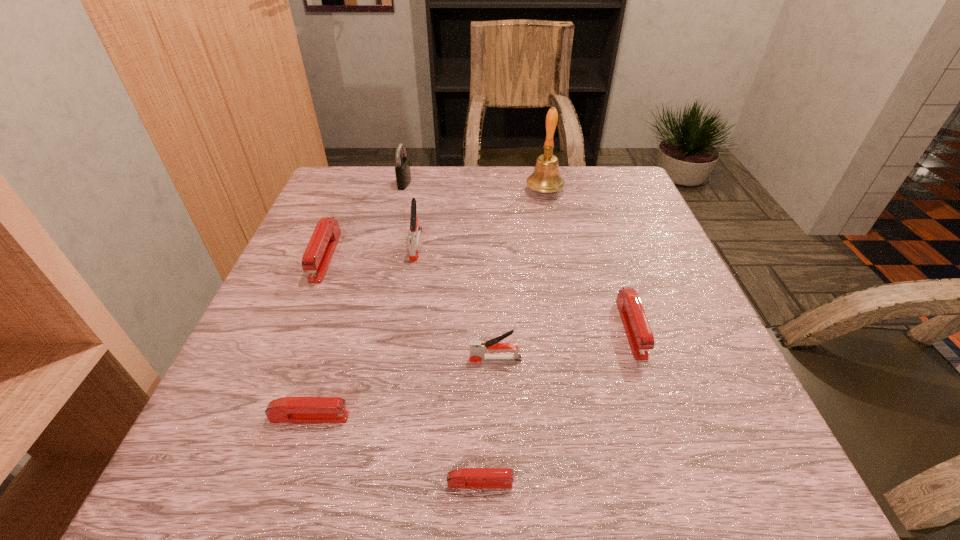
The width and height of the screenshot is (960, 540). In order to click on blank space located on the handle side of the right gray stapler in this screenshot , I will do `click(419, 359)`.

The width and height of the screenshot is (960, 540). I want to click on vacant space located on the front-facing side of the leftmost red stapler, so click(256, 426).

Find the location of `vacant area situated 0.120m on the front-facing side of the rightmost stapler`. vacant area situated 0.120m on the front-facing side of the rightmost stapler is located at coordinates (663, 424).

The width and height of the screenshot is (960, 540). Identify the location of vacant space located on the front-facing side of the fifth tallest stapler. (566, 417).

Where is `vacant area situated on the front-facing side of the smallest red stapler`? This screenshot has width=960, height=540. vacant area situated on the front-facing side of the smallest red stapler is located at coordinates (751, 483).

You are a GUI agent. You are given a task and a screenshot of the screen. Output one action in this format:
    pyautogui.click(x=<x>, y=<y>)
    Task: Click on the bell located in the far edge section of the desktop
    The width and height of the screenshot is (960, 540).
    Given the screenshot: What is the action you would take?
    pyautogui.click(x=546, y=178)

In order to click on padlock located in the far edge section of the desktop in this screenshot , I will do `click(402, 169)`.

Identify the location of object that is at the near edge. This screenshot has height=540, width=960. (465, 478).

This screenshot has height=540, width=960. What are the coordinates of `object at the right edge` in the screenshot? It's located at (638, 331).

In the image, there is a desktop. What are the coordinates of `vacant region at the far edge` in the screenshot? It's located at (578, 207).